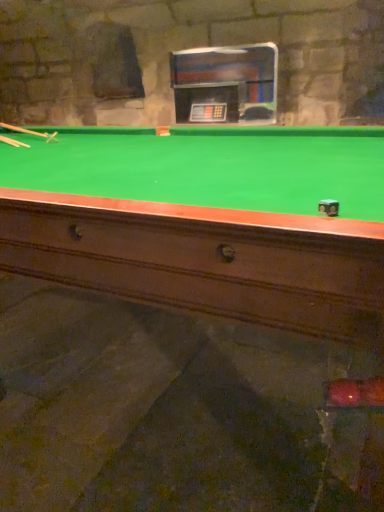
Question: Should I look upward or downward to see wooden cue at left, which is the 2th cue in bottom-to-top order?

Choices:
 (A) up
 (B) down

Answer: (A)

Question: Considering the relative sizes of wooden cue at left, which is the 2th cue in bottom-to-top order, and wooden cue at left, which ranks as the first cue in bottom-to-top order, in the image provided, is wooden cue at left, which is the 2th cue in bottom-to-top order, smaller than wooden cue at left, which ranks as the first cue in bottom-to-top order,?

Choices:
 (A) no
 (B) yes

Answer: (A)

Question: Can you confirm if wooden cue at left, arranged as the 1th cue when viewed from the top, is bigger than wooden cue at left, acting as the second cue starting from the top?

Choices:
 (A) no
 (B) yes

Answer: (B)

Question: Is wooden cue at left, arranged as the 1th cue when viewed from the top, located outside wooden cue at left, acting as the second cue starting from the top?

Choices:
 (A) yes
 (B) no

Answer: (A)

Question: Is wooden cue at left, arranged as the 1th cue when viewed from the top, at the left side of wooden cue at left, which ranks as the first cue in bottom-to-top order?

Choices:
 (A) no
 (B) yes

Answer: (B)

Question: From a real-world perspective, is wooden cue at left, which is the 2th cue in bottom-to-top order, located higher than wooden cue at left, acting as the second cue starting from the top?

Choices:
 (A) yes
 (B) no

Answer: (A)

Question: Considering the relative positions of wooden cue at left, which ranks as the first cue in bottom-to-top order, and wooden cue at left, which is the 2th cue in bottom-to-top order, in the image provided, is wooden cue at left, which ranks as the first cue in bottom-to-top order, to the right of wooden cue at left, which is the 2th cue in bottom-to-top order, from the viewer's perspective?

Choices:
 (A) no
 (B) yes

Answer: (B)

Question: From a real-world perspective, is wooden cue at left, which ranks as the first cue in bottom-to-top order, physically below wooden cue at left, which is the 2th cue in bottom-to-top order?

Choices:
 (A) yes
 (B) no

Answer: (A)

Question: Would you say wooden cue at left, which ranks as the first cue in bottom-to-top order, is outside wooden cue at left, arranged as the 1th cue when viewed from the top?

Choices:
 (A) no
 (B) yes

Answer: (B)

Question: Can you confirm if wooden cue at left, acting as the second cue starting from the top, is smaller than wooden cue at left, which is the 2th cue in bottom-to-top order?

Choices:
 (A) no
 (B) yes

Answer: (B)

Question: Is wooden cue at left, which ranks as the first cue in bottom-to-top order, at the left side of wooden cue at left, which is the 2th cue in bottom-to-top order?

Choices:
 (A) yes
 (B) no

Answer: (B)

Question: Can you confirm if wooden cue at left, which ranks as the first cue in bottom-to-top order, is wider than wooden cue at left, arranged as the 1th cue when viewed from the top?

Choices:
 (A) no
 (B) yes

Answer: (A)

Question: Considering the positions of wooden cue at left, arranged as the 1th cue when viewed from the top, and wooden cue at left, acting as the second cue starting from the top, in the image, is wooden cue at left, arranged as the 1th cue when viewed from the top, bigger or smaller than wooden cue at left, acting as the second cue starting from the top,?

Choices:
 (A) big
 (B) small

Answer: (A)